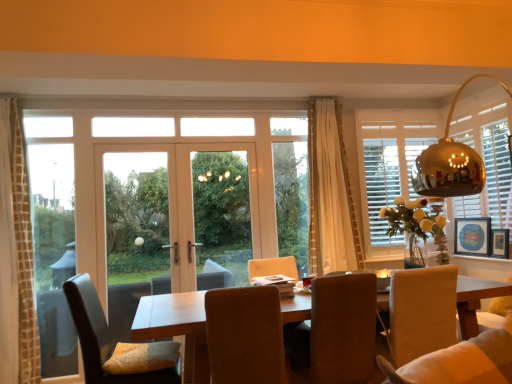
Describe the element at coordinates (392, 164) in the screenshot. The image size is (512, 384). I see `matte white window at right` at that location.

Image resolution: width=512 pixels, height=384 pixels. What do you see at coordinates (101, 337) in the screenshot?
I see `brown leather chair at lower left, which appears as the third chair when viewed from the right` at bounding box center [101, 337].

What do you see at coordinates (136, 218) in the screenshot? Image resolution: width=512 pixels, height=384 pixels. I see `clear glass door at center` at bounding box center [136, 218].

Measure the distance between point (438, 153) and camera.

A distance of 6.52 feet exists between point (438, 153) and camera.

Where is `clear glass window at left`? clear glass window at left is located at coordinates (53, 253).

Where is `matte white window at right`? The width and height of the screenshot is (512, 384). matte white window at right is located at coordinates (392, 164).

Is white wood screen door at center inside the boundaries of white sheer curtain at center, the first curtain viewed from the back, or outside?

white wood screen door at center is located beyond the bounds of white sheer curtain at center, the first curtain viewed from the back.

Between white wood screen door at center and white sheer curtain at center, the first curtain viewed from the right, which one appears on the right side from the viewer's perspective?

white sheer curtain at center, the first curtain viewed from the right, is more to the right.

Image resolution: width=512 pixels, height=384 pixels. I want to click on screen door that is behind the white sheer curtain at center, which ranks as the 2th curtain in front-to-back order, so click(222, 213).

From the image's perspective, who appears lower, white wood screen door at center or white sheer curtain at center, which is counted as the second curtain, starting from the left?

white wood screen door at center, from the image's perspective.

Which is more to the left, wooden table at center or suede-like brown chair at center, arranged as the 2th chair when viewed from the left?

Positioned to the left is suede-like brown chair at center, arranged as the 2th chair when viewed from the left.

Does wooden table at center touch suede-like brown chair at center, arranged as the 2th chair when viewed from the left?

No, wooden table at center is not beside suede-like brown chair at center, arranged as the 2th chair when viewed from the left.

Is clear glass door at center wider or thinner than white glass door at center?

Considering their sizes, clear glass door at center looks slimmer than white glass door at center.

Is clear glass door at center inside the boundaries of white glass door at center, or outside?

clear glass door at center is inside white glass door at center.

From the picture: Which of these two, clear glass door at center or white glass door at center, is bigger?

With larger size is white glass door at center.

Between clear glass door at center and white glass door at center, which one appears on the right side from the viewer's perspective?

Positioned to the right is white glass door at center.

Is brown leather chair at lower left, which appears as the third chair when viewed from the right, wider or thinner than white textured curtain at left, the 2th curtain from the right?

Clearly, brown leather chair at lower left, which appears as the third chair when viewed from the right, has more width compared to white textured curtain at left, the 2th curtain from the right.

Is brown leather chair at lower left, which appears as the third chair when viewed from the right, at the left side of white textured curtain at left, the first curtain viewed from the left?

No.

From the image's perspective, which one is positioned higher, brown leather chair at lower left, which appears as the third chair when viewed from the right, or white textured curtain at left, the first curtain viewed from the left?

white textured curtain at left, the first curtain viewed from the left, appears higher in the image.

Could you tell me if brown leather chair at lower left, which appears as the third chair when viewed from the right, is turned towards white textured curtain at left, the first curtain viewed from the left?

No.

Between wooden framed artwork at right, which is the 1th picture frame in back-to-front order, and matte white window at right, which one has more height?

matte white window at right is taller.

Image resolution: width=512 pixels, height=384 pixels. In order to click on window that is above the wooden framed artwork at right, positioned as the second picture frame in front-to-back order (from a real-world perspective) in this screenshot , I will do `click(392, 164)`.

Is point (464, 236) positioned before point (432, 142)?

Yes, point (464, 236) is closer to viewer.

Considering the relative sizes of wooden framed artwork at right, which is the 1th picture frame in back-to-front order, and matte white window at right in the image provided, is wooden framed artwork at right, which is the 1th picture frame in back-to-front order, bigger than matte white window at right?

Incorrect, wooden framed artwork at right, which is the 1th picture frame in back-to-front order, is not larger than matte white window at right.

Which of these two, white wood screen door at center or brown fabric chair at center, acting as the first chair starting from the right, stands taller?

white wood screen door at center.

Is white wood screen door at center oriented away from brown fabric chair at center, acting as the first chair starting from the right?

white wood screen door at center does not have its back to brown fabric chair at center, acting as the first chair starting from the right.

Considering the relative sizes of white wood screen door at center and brown fabric chair at center, acting as the first chair starting from the right, in the image provided, is white wood screen door at center smaller than brown fabric chair at center, acting as the first chair starting from the right,?

Yes, white wood screen door at center is smaller than brown fabric chair at center, acting as the first chair starting from the right.

Can you see white glass door at center touching white wood screen door at center?

No, white glass door at center is not in contact with white wood screen door at center.

Considering the relative positions of white glass door at center and white wood screen door at center in the image provided, is white glass door at center to the left of white wood screen door at center from the viewer's perspective?

Yes, white glass door at center is to the left of white wood screen door at center.

Is point (206, 226) behind point (224, 173)?

No, (206, 226) is in front of (224, 173).

Does white glass door at center turn towards white wood screen door at center?

Yes, white glass door at center is turned towards white wood screen door at center.

This screenshot has height=384, width=512. I want to click on curtain located above the white wood screen door at center (from a real-world perspective), so click(x=331, y=195).

At what (x,y) coordinates should I click in order to perform the action: click on chair that is the 2nd object located above the wooden table at center (from the image's perspective). Please return your answer as a coordinate pair (x, y). This screenshot has width=512, height=384. Looking at the image, I should click on (245, 336).

Looking at the image, which one is located closer to clear glass door at center, white textured curtain at left, the 1th curtain from the front, or suede-like brown chair at center, arranged as the 2th chair when viewed from the left?

Among the two, white textured curtain at left, the 1th curtain from the front, is located nearer to clear glass door at center.

From the image, which object appears to be nearer to clear glass door at center, wooden picture frame at right, placed as the 2th picture frame when sorted from back to front, or white wood screen door at center?

white wood screen door at center is positioned closer to the anchor clear glass door at center.

Considering their positions, is clear glass window at left positioned closer to white glass door at center than wooden table at center?

clear glass window at left.

Looking at the image, which one is located further to clear glass window at left, brown leather chair at lower left, the first chair positioned from the left, or white glass door at center?

The object further to clear glass window at left is brown leather chair at lower left, the first chair positioned from the left.

Based on their spatial positions, is brown fabric chair at center, which is the third chair from left to right, or wooden picture frame at right, placed as the 2th picture frame when sorted from back to front, closer to gold reflective lampshade at upper right?

brown fabric chair at center, which is the third chair from left to right, lies closer to gold reflective lampshade at upper right than the other object.

Estimate the real-world distances between objects in this image. Which object is closer to matte white window at right, wooden framed artwork at right, which is the 1th picture frame in back-to-front order, or white sheer curtain at center, the first curtain viewed from the right?

wooden framed artwork at right, which is the 1th picture frame in back-to-front order, lies closer to matte white window at right than the other object.

Which object lies further to the anchor point wooden table at center, wooden picture frame at right, which is counted as the 1th picture frame, starting from the front, or gold reflective lampshade at upper right?

wooden picture frame at right, which is counted as the 1th picture frame, starting from the front, is further to wooden table at center.

Estimate the real-world distances between objects in this image. Which object is further from wooden table at center, brown leather chair at lower left, the first chair positioned from the left, or wooden picture frame at right, placed as the 2th picture frame when sorted from back to front?

wooden picture frame at right, placed as the 2th picture frame when sorted from back to front, is positioned further to the anchor wooden table at center.

Locate an element on the screen. This screenshot has width=512, height=384. curtain located between white glass door at center and wooden picture frame at right, which is counted as the 1th picture frame, starting from the front, in the left-right direction is located at coordinates (331, 195).

You are a GUI agent. You are given a task and a screenshot of the screen. Output one action in this format:
    pyautogui.click(x=<x>, y=<y>)
    Task: Click on the screen door located between brown leather chair at lower left, the first chair positioned from the left, and wooden picture frame at right, which is counted as the 1th picture frame, starting from the front, in the left-right direction
    
    Given the screenshot: What is the action you would take?
    pyautogui.click(x=222, y=213)

The image size is (512, 384). Find the location of `chair between white textured curtain at left, which is the 2th curtain from back to front, and white wood screen door at center, in the horizontal direction`. chair between white textured curtain at left, which is the 2th curtain from back to front, and white wood screen door at center, in the horizontal direction is located at coordinates (101, 337).

The width and height of the screenshot is (512, 384). In order to click on curtain between clear glass door at center and matte white window at right in the horizontal direction in this screenshot , I will do `click(331, 195)`.